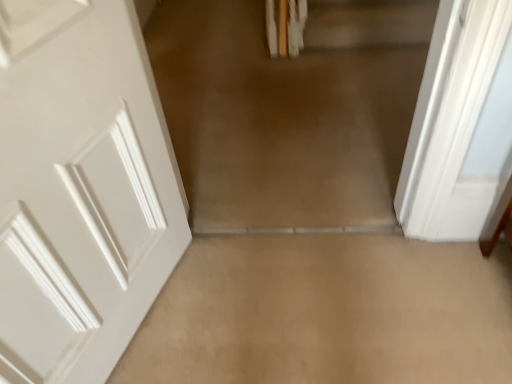
The image size is (512, 384). I want to click on beige carpet at center, so click(x=290, y=111).

This screenshot has height=384, width=512. Describe the element at coordinates (290, 111) in the screenshot. I see `beige carpet at center` at that location.

The image size is (512, 384). Identify the location of beige carpet at center. (290, 111).